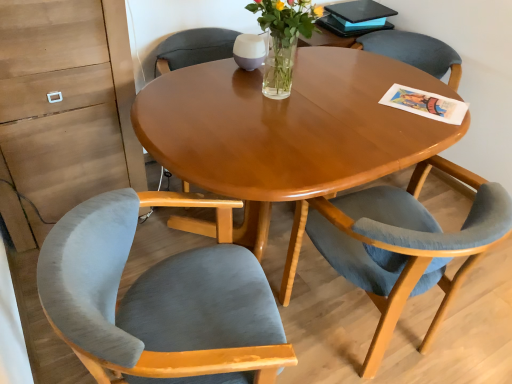
Question: Is velvet blue chair at lower right, positioned as the second chair in left-to-right order, facing away from velvet grey chair at left, which is counted as the first chair, starting from the left?

Choices:
 (A) no
 (B) yes

Answer: (A)

Question: From a real-world perspective, is velvet blue chair at lower right, positioned as the 1th chair in right-to-left order, over velvet grey chair at left, which is counted as the first chair, starting from the left?

Choices:
 (A) yes
 (B) no

Answer: (A)

Question: Is velvet blue chair at lower right, positioned as the 1th chair in right-to-left order, oriented towards velvet grey chair at left, which is counted as the first chair, starting from the left?

Choices:
 (A) no
 (B) yes

Answer: (A)

Question: Can you confirm if velvet blue chair at lower right, positioned as the 1th chair in right-to-left order, is thinner than velvet grey chair at left, the second chair when ordered from right to left?

Choices:
 (A) yes
 (B) no

Answer: (A)

Question: From a real-world perspective, does velvet blue chair at lower right, positioned as the 1th chair in right-to-left order, sit lower than velvet grey chair at left, the second chair when ordered from right to left?

Choices:
 (A) yes
 (B) no

Answer: (B)

Question: From the image's perspective, is velvet blue chair at lower right, positioned as the 1th chair in right-to-left order, below velvet grey chair at left, which is counted as the first chair, starting from the left?

Choices:
 (A) no
 (B) yes

Answer: (A)

Question: Is clear glass vase at center completely or partially outside of velvet grey chair at left, which is counted as the first chair, starting from the left?

Choices:
 (A) no
 (B) yes

Answer: (B)

Question: Can you confirm if clear glass vase at center is taller than velvet grey chair at left, the second chair when ordered from right to left?

Choices:
 (A) yes
 (B) no

Answer: (B)

Question: Is clear glass vase at center wider than velvet grey chair at left, the second chair when ordered from right to left?

Choices:
 (A) no
 (B) yes

Answer: (A)

Question: From a real-world perspective, is clear glass vase at center located beneath velvet grey chair at left, which is counted as the first chair, starting from the left?

Choices:
 (A) yes
 (B) no

Answer: (B)

Question: Is velvet grey chair at left, the second chair when ordered from right to left, located within clear glass vase at center?

Choices:
 (A) no
 (B) yes

Answer: (A)

Question: From the image's perspective, is clear glass vase at center on top of velvet grey chair at left, which is counted as the first chair, starting from the left?

Choices:
 (A) no
 (B) yes

Answer: (B)

Question: Is velvet grey chair at left, the second chair when ordered from right to left, located outside velvet blue chair at lower right, positioned as the second chair in left-to-right order?

Choices:
 (A) no
 (B) yes

Answer: (B)